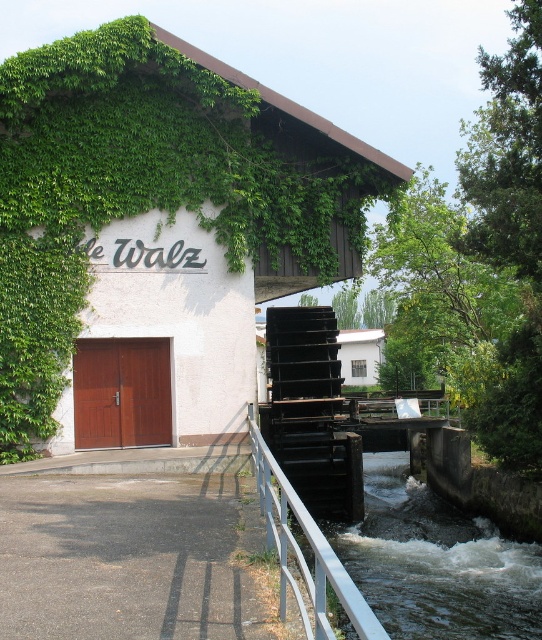
You are a painter planning to paint the green ivy at upper left and the silver metallic rail at lower center. Which object requires more paint due to its size?

The green ivy at upper left requires more paint because it is larger in size than the silver metallic rail at lower center.

You are a painter standing at the base of the watermill and want to paint the green ivy at upper left and the silver metallic rail at lower center. Which object is taller?

The green ivy at upper left is taller than the silver metallic rail at lower center.